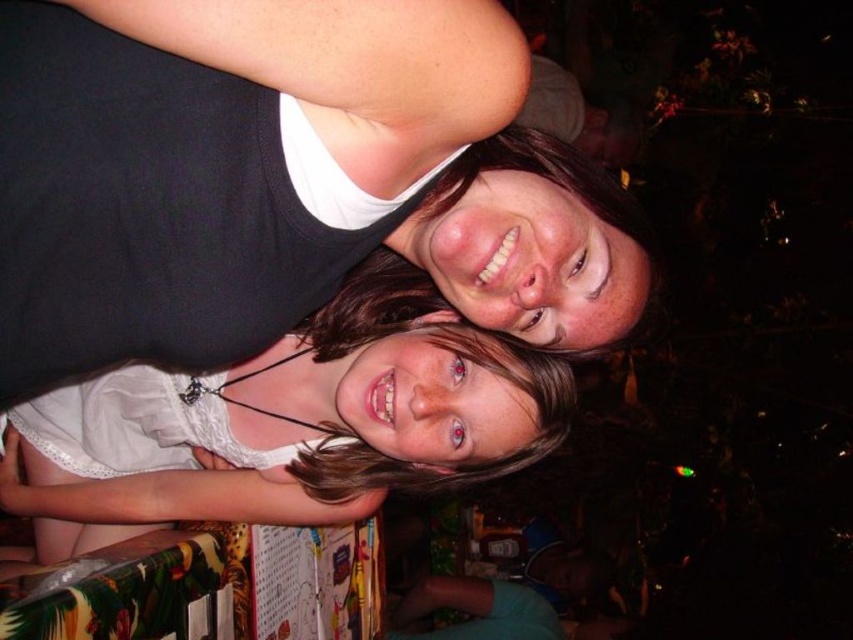
Question: Is matte black tank top at upper center positioned before white lace dress at center?

Choices:
 (A) no
 (B) yes

Answer: (B)

Question: Among these objects, which one is nearest to the camera?

Choices:
 (A) white lace dress at center
 (B) matte black tank top at upper center

Answer: (B)

Question: Does matte black tank top at upper center have a greater width compared to white lace dress at center?

Choices:
 (A) yes
 (B) no

Answer: (B)

Question: Which of the following is the closest to the observer?

Choices:
 (A) (538, 412)
 (B) (560, 200)

Answer: (B)

Question: Observing the image, what is the correct spatial positioning of matte black tank top at upper center in reference to white lace dress at center?

Choices:
 (A) below
 (B) above

Answer: (B)

Question: Among these objects, which one is nearest to the camera?

Choices:
 (A) white lace dress at center
 (B) matte black tank top at upper center

Answer: (B)